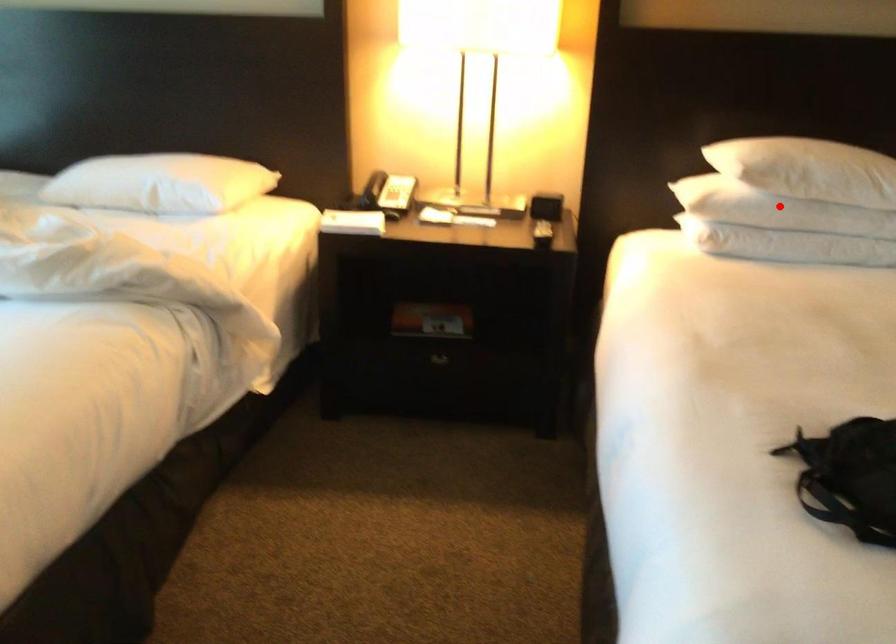
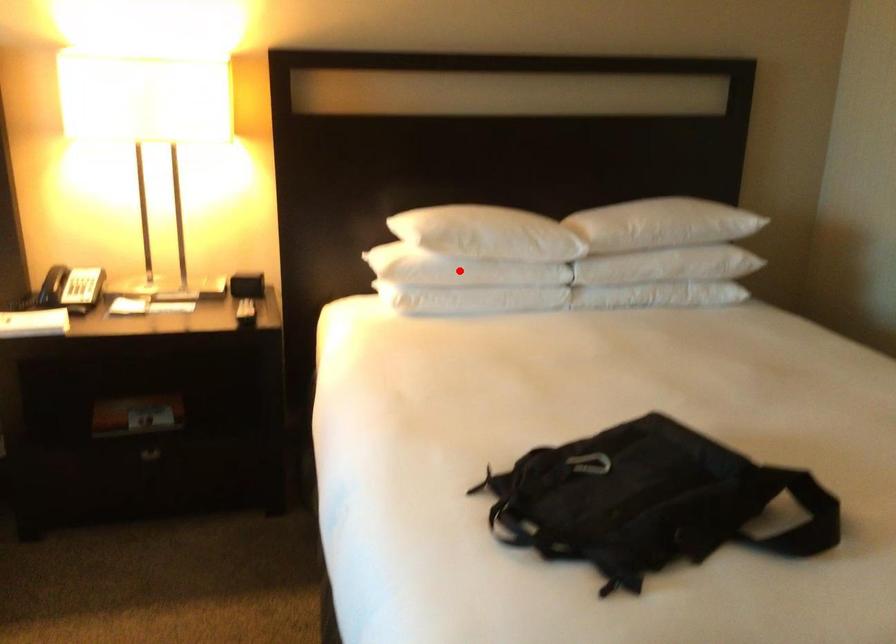
I am providing you with two images of the same scene from different viewpoints. A red point is marked on the first image and another point is marked on the second image. Does the point marked in image1 correspond to the same location as the one in image2?

Yes